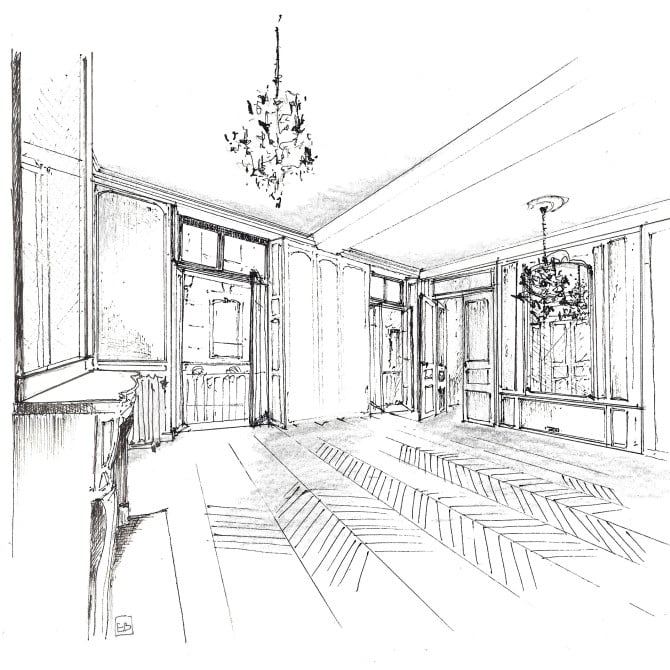
Locate an element on the screen. This screenshot has height=670, width=670. the right wall is located at coordinates (630, 376).